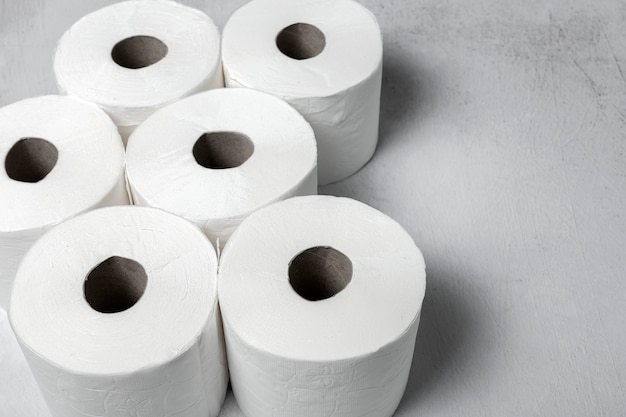
Locate an element on the screen. The height and width of the screenshot is (417, 626). toilet paper rolls is located at coordinates (198, 64), (278, 71), (268, 136), (98, 155), (136, 242), (247, 275).